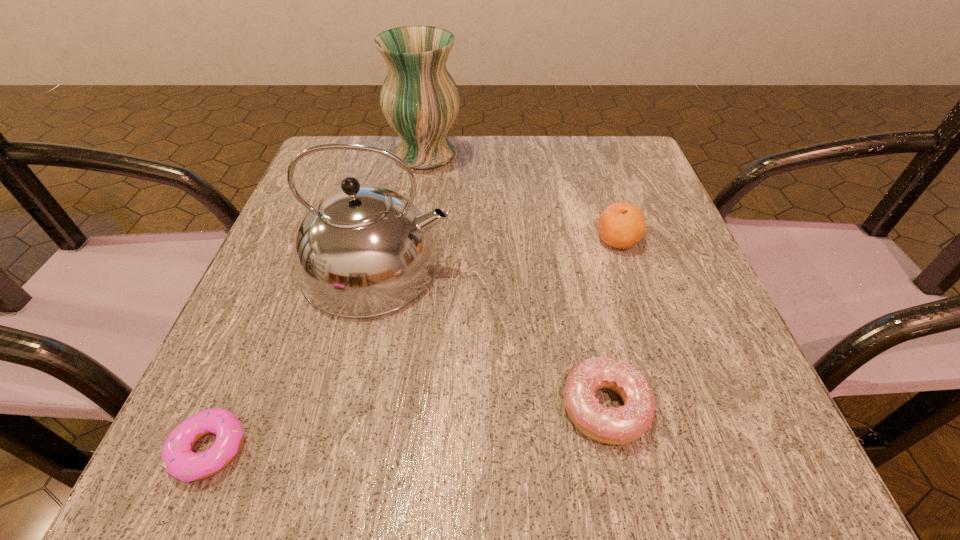
Identify the location of vase. The width and height of the screenshot is (960, 540). (420, 100).

What are the coordinates of `kettle` in the screenshot? It's located at (361, 251).

Find the location of `the third tallest object`. the third tallest object is located at coordinates (621, 225).

Where is `the fourth tallest object`? the fourth tallest object is located at coordinates (621, 425).

You are a GUI agent. You are given a task and a screenshot of the screen. Output one action in this format:
    pyautogui.click(x=<x>, y=<y>)
    Task: Click on the taller doughnut
    This screenshot has height=540, width=960.
    Given the screenshot: What is the action you would take?
    pyautogui.click(x=621, y=425)

Where is `the shorter doughnut`? Image resolution: width=960 pixels, height=540 pixels. the shorter doughnut is located at coordinates (179, 460).

Where is `the left doughnut`? The image size is (960, 540). the left doughnut is located at coordinates (179, 460).

This screenshot has width=960, height=540. Identify the location of free space located 0.240m on the front of the vase. (410, 248).

This screenshot has width=960, height=540. I want to click on blank area located 0.310m from the spout of the kettle, so click(630, 266).

Locate an element on the screen. free space located on the front of the clementine is located at coordinates (674, 411).